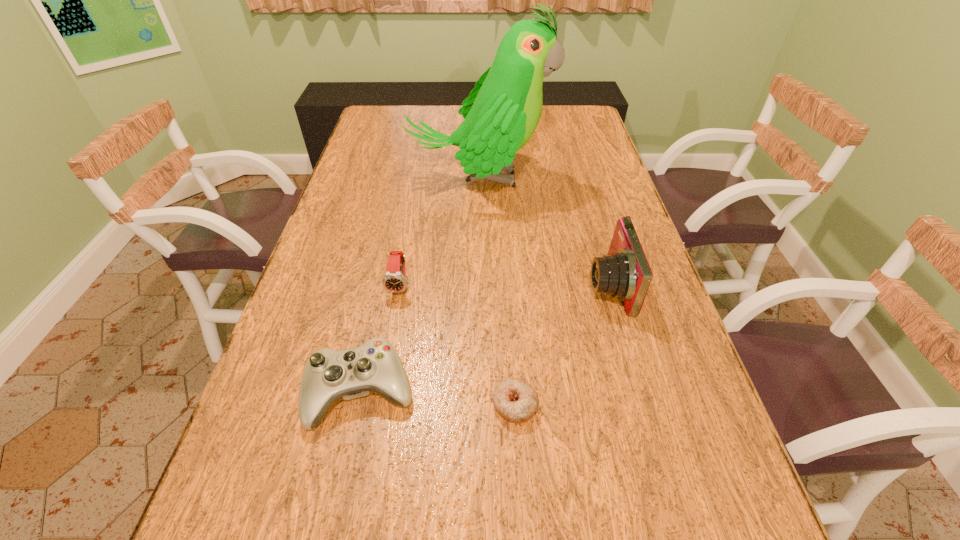
I want to click on the farthest object, so click(x=501, y=114).

You are a GUI agent. You are given a task and a screenshot of the screen. Output one action in this format:
    pyautogui.click(x=<x>, y=<y>)
    Task: Click on the parakeet
    The height and width of the screenshot is (540, 960).
    Given the screenshot: What is the action you would take?
    pyautogui.click(x=501, y=114)

This screenshot has width=960, height=540. Find the location of `camera`. camera is located at coordinates (624, 273).

I want to click on the fourth shortest object, so click(x=624, y=273).

Image resolution: width=960 pixels, height=540 pixels. I want to click on watch, so click(394, 280).

In order to click on control in this screenshot , I will do `click(375, 366)`.

Locate an element on the screen. The image size is (960, 540). the shortest object is located at coordinates (515, 399).

Find the location of a particular element. vacant space located 0.120m on the beak of the farthest object is located at coordinates (588, 179).

You are a GUI agent. You are given a task and a screenshot of the screen. Output one action in this format:
    pyautogui.click(x=<x>, y=<y>)
    Task: Click on the vacant point located on the front-facing side of the camera
    This screenshot has width=960, height=540.
    Given the screenshot: What is the action you would take?
    pyautogui.click(x=520, y=285)

Locate an element on the screen. free spot located 0.060m on the front-facing side of the camera is located at coordinates (562, 285).